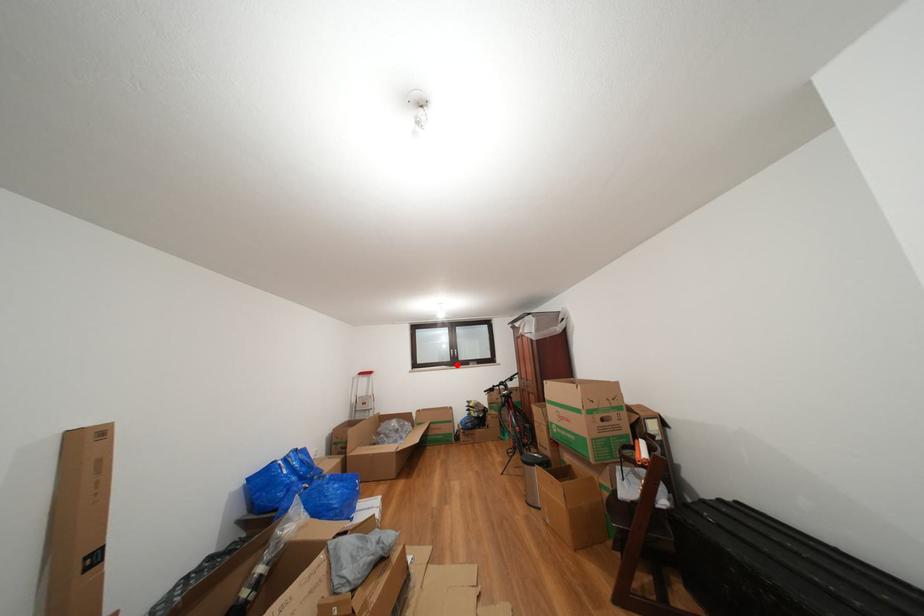
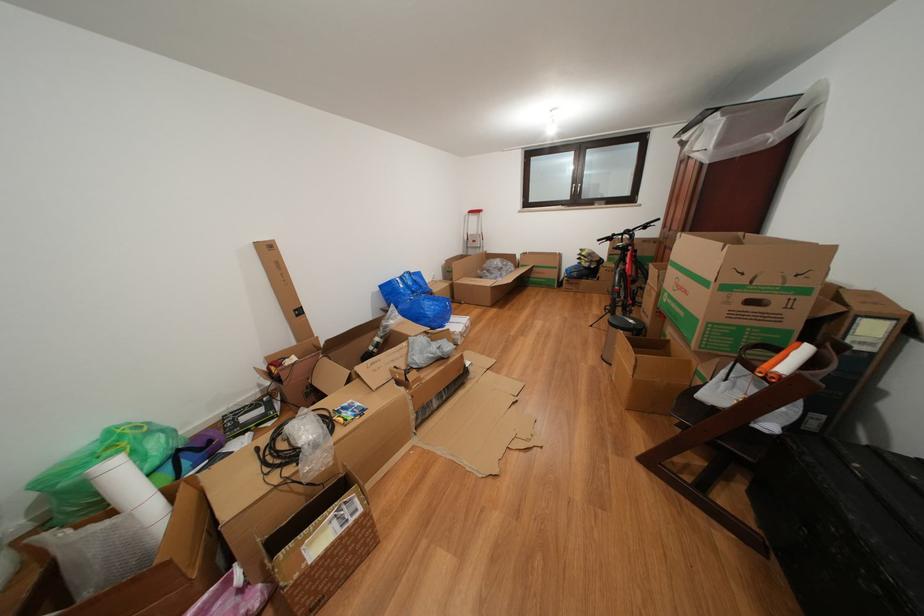
Question: A red point is marked in image1. In image2, is the corresponding 3D point closer to the camera or farther? Reply with the corresponding letter.

Choices:
 (A) The corresponding 3D point is closer.
 (B) The corresponding 3D point is farther.

Answer: (A)